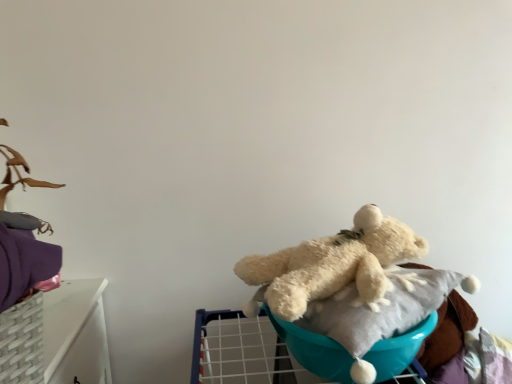
Image resolution: width=512 pixels, height=384 pixels. Find the location of `fluffy white teddy bear at center`. fluffy white teddy bear at center is located at coordinates (336, 264).

What is the approximate height of fluffy white teddy bear at center?

The height of fluffy white teddy bear at center is 17.90 centimeters.

What is the approximate width of fluffy white teddy bear at center?

14.70 inches.

The height and width of the screenshot is (384, 512). What do you see at coordinates (336, 264) in the screenshot? I see `fluffy white teddy bear at center` at bounding box center [336, 264].

Image resolution: width=512 pixels, height=384 pixels. What do you see at coordinates (379, 320) in the screenshot?
I see `white plush bear at center` at bounding box center [379, 320].

Locate an element on the screen. white plush bear at center is located at coordinates (379, 320).

Locate an element on the screen. This screenshot has height=384, width=512. fluffy white teddy bear at center is located at coordinates (336, 264).

Would you say white plush bear at center is to the left or to the right of fluffy white teddy bear at center in the picture?

In the image, white plush bear at center appears on the right side of fluffy white teddy bear at center.

Consider the image. Considering the positions of objects white plush bear at center and fluffy white teddy bear at center in the image provided, who is in front, white plush bear at center or fluffy white teddy bear at center?

white plush bear at center is closer to the camera.

Considering the points (212, 341) and (308, 290), which point is behind, point (212, 341) or point (308, 290)?

Positioned behind is point (212, 341).

From the image's perspective, is white plush bear at center positioned above or below fluffy white teddy bear at center?

white plush bear at center is below fluffy white teddy bear at center.

From a real-world perspective, who is located lower, white plush bear at center or fluffy white teddy bear at center?

From a 3D spatial view, white plush bear at center is below.

Is white plush bear at center thinner than fluffy white teddy bear at center?

Indeed, white plush bear at center has a lesser width compared to fluffy white teddy bear at center.

From their relative heights in the image, would you say white plush bear at center is taller or shorter than fluffy white teddy bear at center?

white plush bear at center is shorter than fluffy white teddy bear at center.

Considering the relative sizes of white plush bear at center and fluffy white teddy bear at center in the image provided, is white plush bear at center bigger than fluffy white teddy bear at center?

No, white plush bear at center is not bigger than fluffy white teddy bear at center.

Would you say white plush bear at center contains fluffy white teddy bear at center?

That's incorrect, fluffy white teddy bear at center is not inside white plush bear at center.

Consider the image. Is white plush bear at center positioned far away from fluffy white teddy bear at center?

No, white plush bear at center is in close proximity to fluffy white teddy bear at center.

Is white plush bear at center oriented towards fluffy white teddy bear at center?

No, white plush bear at center is not oriented towards fluffy white teddy bear at center.

Locate an element on the screen. baby carriage that is on the right side of fluffy white teddy bear at center is located at coordinates (379, 320).

In the image, is fluffy white teddy bear at center on the left side or the right side of white plush bear at center?

In the image, fluffy white teddy bear at center appears on the left side of white plush bear at center.

Relative to white plush bear at center, is fluffy white teddy bear at center in front or behind?

Visually, fluffy white teddy bear at center is located behind white plush bear at center.

Is point (315, 261) closer or farther from the camera than point (441, 271)?

Point (315, 261).

From the image's perspective, who appears lower, fluffy white teddy bear at center or white plush bear at center?

white plush bear at center.

From a real-world perspective, relative to white plush bear at center, is fluffy white teddy bear at center vertically above or below?

fluffy white teddy bear at center is above white plush bear at center.

Can you confirm if fluffy white teddy bear at center is wider than white plush bear at center?

Indeed, fluffy white teddy bear at center has a greater width compared to white plush bear at center.

Between fluffy white teddy bear at center and white plush bear at center, which one has more height?

Standing taller between the two is fluffy white teddy bear at center.

Considering the sizes of objects fluffy white teddy bear at center and white plush bear at center in the image provided, who is bigger, fluffy white teddy bear at center or white plush bear at center?

fluffy white teddy bear at center is bigger.

Is fluffy white teddy bear at center not inside white plush bear at center?

Indeed, fluffy white teddy bear at center is completely outside white plush bear at center.

Is fluffy white teddy bear at center with white plush bear at center?

Yes.

Is fluffy white teddy bear at center facing towards white plush bear at center?

No, fluffy white teddy bear at center is not turned towards white plush bear at center.

Can you tell me how much fluffy white teddy bear at center and white plush bear at center differ in facing direction?

14.6 degrees.

Where is `baby carriage on the right of fluffy white teddy bear at center`? baby carriage on the right of fluffy white teddy bear at center is located at coordinates (379, 320).

Identify the location of teddy bear on the left of white plush bear at center. This screenshot has width=512, height=384. (336, 264).

At what (x,y) coordinates should I click in order to perform the action: click on baby carriage on the right of fluffy white teddy bear at center. Please return your answer as a coordinate pair (x, y). This screenshot has height=384, width=512. Looking at the image, I should click on (379, 320).